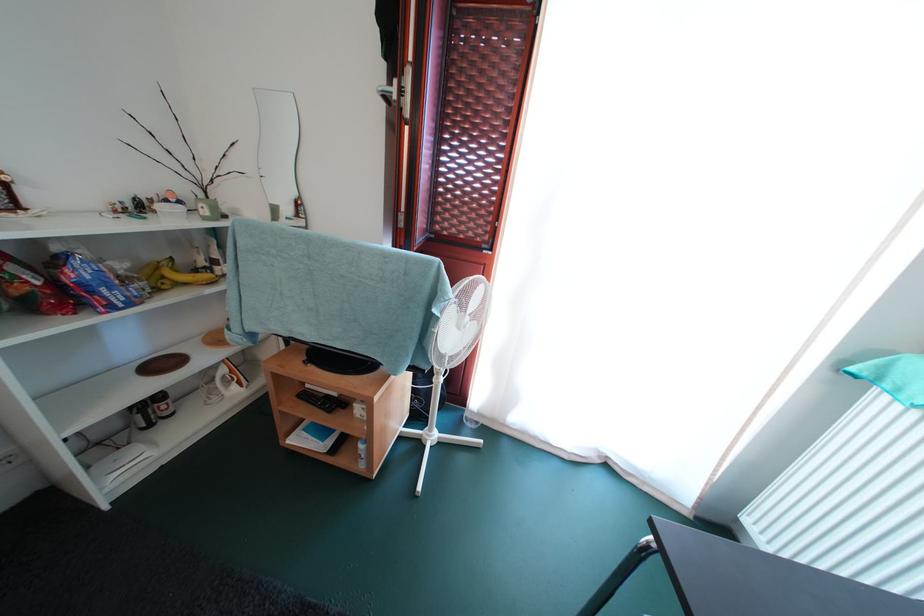
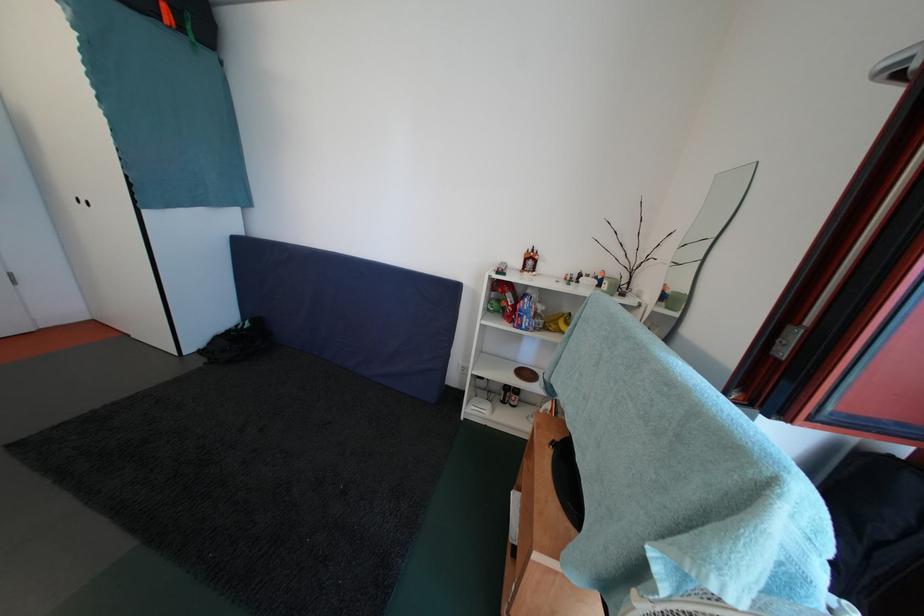
Question: Based on the continuous images, in which direction is the camera rotating? Reply with the corresponding letter.

Choices:
 (A) Left
 (B) Right
 (C) Up
 (D) Down

Answer: (A)